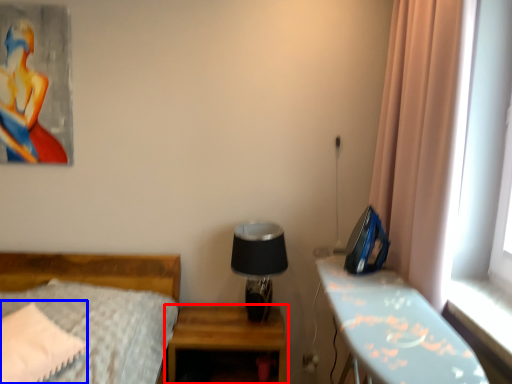
Question: Which of the following is the farthest to the observer, nightstand (highlighted by a red box) or pillow (highlighted by a blue box)?

Choices:
 (A) nightstand
 (B) pillow

Answer: (A)